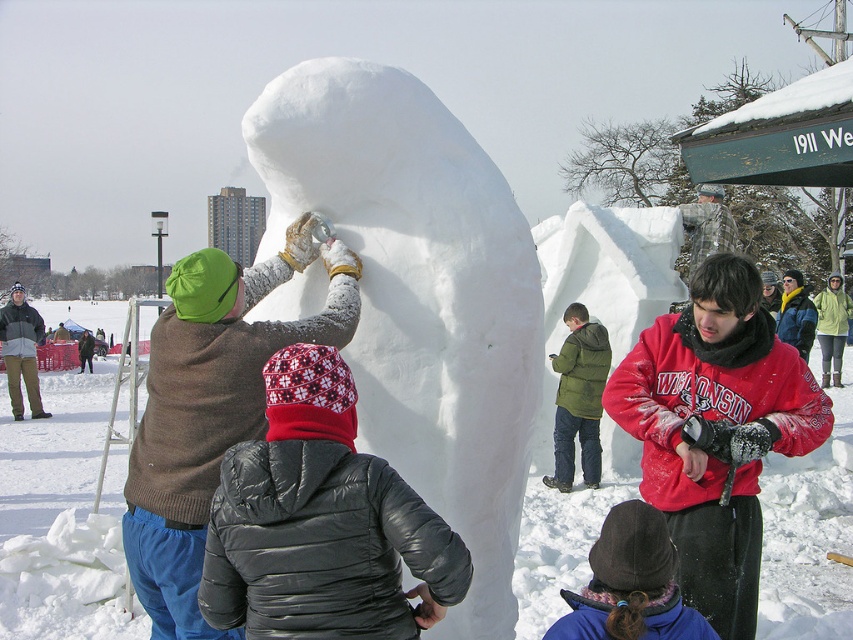
Question: Which point appears farthest from the camera in this image?

Choices:
 (A) (396, 104)
 (B) (136, 547)
 (C) (546, 476)

Answer: (C)

Question: Does brown wool sweater at upper left appear on the right side of green puffy jacket at center?

Choices:
 (A) no
 (B) yes

Answer: (A)

Question: Which of the following is the farthest from the observer?

Choices:
 (A) (448, 376)
 (B) (577, 388)

Answer: (B)

Question: Observing the image, what is the correct spatial positioning of white fluffy snowman at center in reference to brown wool sweater at upper left?

Choices:
 (A) right
 (B) left

Answer: (A)

Question: Estimate the real-world distances between objects in this image. Which object is closer to the green puffy jacket at center?

Choices:
 (A) white fluffy snowman at center
 (B) brown wool sweater at upper left

Answer: (A)

Question: Does brown wool sweater at upper left appear under green puffy jacket at center?

Choices:
 (A) yes
 (B) no

Answer: (B)